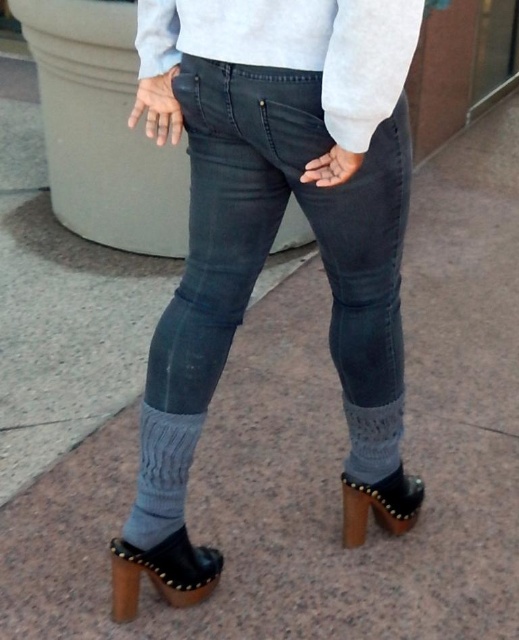
Between dark denim jeans at center and light gray sweater at center, which one has less height?

With less height is light gray sweater at center.

Does point (359, 336) lie behind point (140, 42)?

Yes.

Which is in front, point (377, 424) or point (361, 141)?

Point (361, 141) is in front.

At what (x,y) coordinates should I click in order to perform the action: click on dark denim jeans at center. Please return your answer as a coordinate pair (x, y). The height and width of the screenshot is (640, 519). Looking at the image, I should click on (270, 243).

Can you confirm if dark denim jeans at center is positioned to the right of matte black clog at lower right?

In fact, dark denim jeans at center is to the left of matte black clog at lower right.

Who is positioned more to the right, dark denim jeans at center or matte black clog at lower right?

Positioned to the right is matte black clog at lower right.

Where is `dark denim jeans at center`? This screenshot has width=519, height=640. dark denim jeans at center is located at coordinates [x=270, y=243].

Where is `dark denim jeans at center`? Image resolution: width=519 pixels, height=640 pixels. dark denim jeans at center is located at coordinates (270, 243).

Can you confirm if dark denim jeans at center is positioned to the right of black leather sandal at lower right?

Yes, dark denim jeans at center is to the right of black leather sandal at lower right.

In the scene shown: Who is positioned more to the right, dark denim jeans at center or black leather sandal at lower right?

From the viewer's perspective, dark denim jeans at center appears more on the right side.

Identify the location of dark denim jeans at center. The height and width of the screenshot is (640, 519). coord(270,243).

Where is `dark denim jeans at center`? dark denim jeans at center is located at coordinates (270, 243).